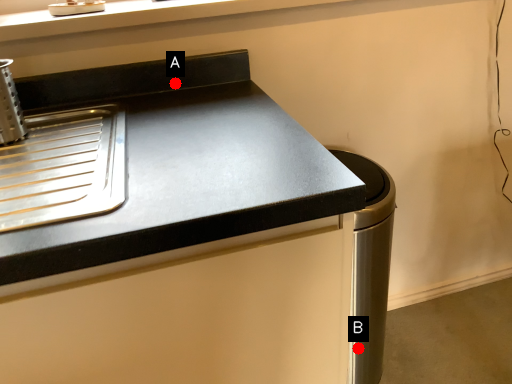
Question: Two points are circled on the image, labeled by A and B beside each circle. Which point is closer to the camera taking this photo?

Choices:
 (A) A is closer
 (B) B is closer

Answer: (A)